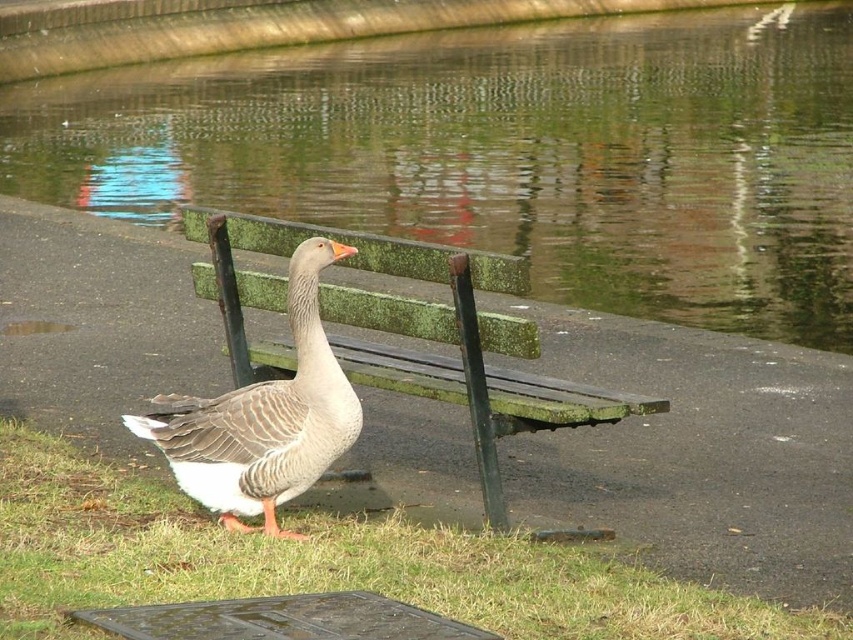
Question: Estimate the real-world distances between objects in this image. Which object is farther from the green grass at lower left?

Choices:
 (A) gray matte duck at center
 (B) green mossy bench at center
 (C) greenish water at bench right

Answer: (C)

Question: Which object appears farthest from the camera in this image?

Choices:
 (A) greenish water at bench right
 (B) green mossy bench at center

Answer: (A)

Question: Does green grass at lower left have a lesser width compared to green mossy bench at center?

Choices:
 (A) yes
 (B) no

Answer: (B)

Question: Can you confirm if greenish water at bench right is bigger than green mossy bench at center?

Choices:
 (A) yes
 (B) no

Answer: (A)

Question: Which of these objects is positioned farthest from the green grass at lower left?

Choices:
 (A) gray matte duck at center
 (B) green mossy bench at center
 (C) greenish water at bench right

Answer: (C)

Question: Where is green mossy bench at center located in relation to gray matte duck at center in the image?

Choices:
 (A) below
 (B) above

Answer: (B)